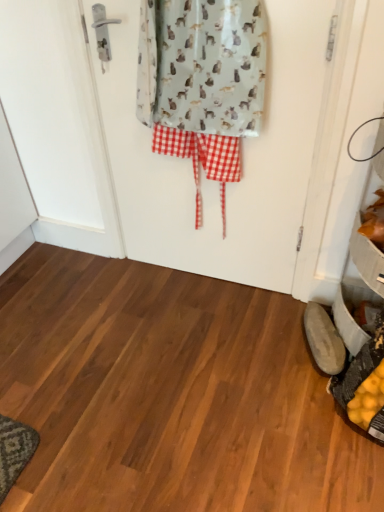
Question: Relative to light gray fabric with cat print at center, is light gray fabric screen door at center in front or behind?

Choices:
 (A) behind
 (B) front

Answer: (A)

Question: In the image, is light gray fabric screen door at center on the left side or the right side of light gray fabric with cat print at center?

Choices:
 (A) right
 (B) left

Answer: (A)

Question: Which is farther from the light gray fabric screen door at center?

Choices:
 (A) orange matte leaves at lower right
 (B) light gray fabric with cat print at center
 (C) brown leather shoe at lower right

Answer: (C)

Question: Which is nearer to the light gray fabric screen door at center?

Choices:
 (A) orange matte leaves at lower right
 (B) brown leather shoe at lower right
 (C) light gray fabric with cat print at center

Answer: (C)